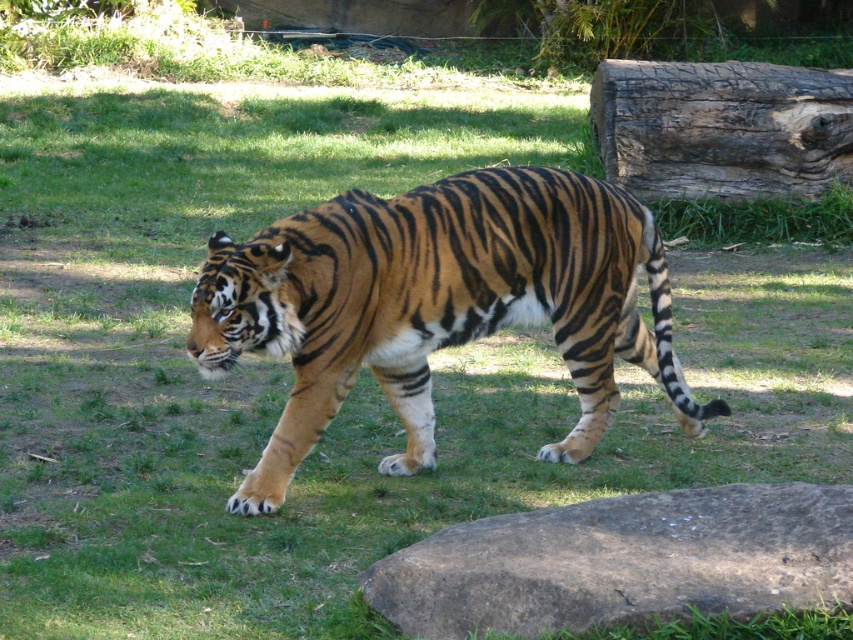
Is point (476, 330) less distant than point (769, 163)?

Yes, it is.

This screenshot has height=640, width=853. What do you see at coordinates (437, 304) in the screenshot?
I see `orange-brown striped tiger at center` at bounding box center [437, 304].

Locate an element on the screen. The width and height of the screenshot is (853, 640). orange-brown striped tiger at center is located at coordinates (437, 304).

Which is behind, point (523, 609) or point (595, 92)?

Positioned behind is point (595, 92).

Is brown rough rock at lower right above dark brown textured log at upper right?

Incorrect, brown rough rock at lower right is not positioned above dark brown textured log at upper right.

Between point (664, 600) and point (720, 64), which one is positioned in front?

Point (664, 600) is in front.

Where is `brown rough rock at lower right`? The image size is (853, 640). brown rough rock at lower right is located at coordinates (624, 561).

The image size is (853, 640). What do you see at coordinates (437, 304) in the screenshot? I see `orange-brown striped tiger at center` at bounding box center [437, 304].

In the scene shown: Is orange-brown striped tiger at center positioned in front of brown rough rock at lower right?

No.

Is point (395, 396) behind point (393, 609)?

Yes, point (395, 396) is farther from viewer.

Identify the location of orange-brown striped tiger at center. Image resolution: width=853 pixels, height=640 pixels. (437, 304).